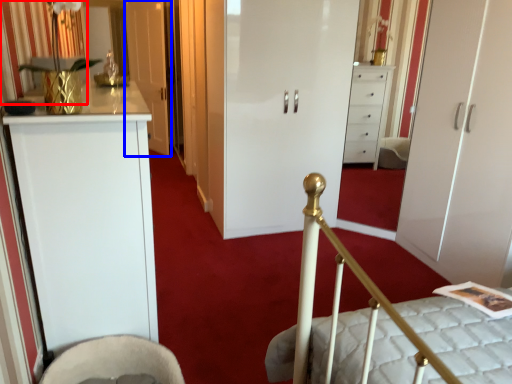
Question: Which object is closer to the camera taking this photo, curtain (highlighted by a red box) or door (highlighted by a blue box)?

Choices:
 (A) curtain
 (B) door

Answer: (A)